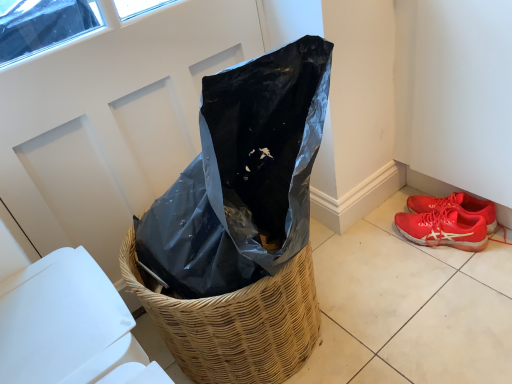
Locate an element on the screen. Image resolution: width=512 pixels, height=384 pixels. vacant space to the right of woven straw basket at center is located at coordinates (395, 292).